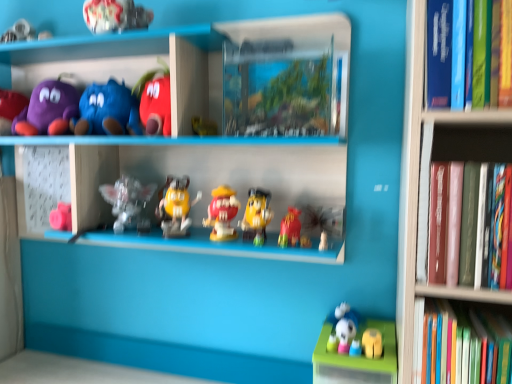
Question: Is purple plush toy at upper left, the second toy viewed from the left, beside smooth plastic m&m figure at center, positioned as the seventh toy in left-to-right order?

Choices:
 (A) no
 (B) yes

Answer: (A)

Question: Is purple plush toy at upper left, the second toy viewed from the left, oriented away from smooth plastic m&m figure at center, positioned as the seventh toy in left-to-right order?

Choices:
 (A) yes
 (B) no

Answer: (B)

Question: Is purple plush toy at upper left, the second toy viewed from the left, positioned in front of smooth plastic m&m figure at center, which is the fourth toy from right to left?

Choices:
 (A) yes
 (B) no

Answer: (B)

Question: Is smooth plastic m&m figure at center, which is the fourth toy from right to left, located within purple plush toy at upper left, the second toy viewed from the left?

Choices:
 (A) yes
 (B) no

Answer: (B)

Question: From the image's perspective, is purple plush toy at upper left, the second toy viewed from the left, over smooth plastic m&m figure at center, which is the fourth toy from right to left?

Choices:
 (A) no
 (B) yes

Answer: (B)

Question: From their relative heights in the image, would you say metallic silver toy at upper center, marked as the fifth toy in a left-to-right arrangement, is taller or shorter than matte plush toy at upper left, the eighth toy when ordered from right to left?

Choices:
 (A) short
 (B) tall

Answer: (A)

Question: Choose the correct answer: Is metallic silver toy at upper center, marked as the fifth toy in a left-to-right arrangement, inside matte plush toy at upper left, the eighth toy when ordered from right to left, or outside it?

Choices:
 (A) outside
 (B) inside

Answer: (A)

Question: Looking at their shapes, would you say metallic silver toy at upper center, marked as the fifth toy in a left-to-right arrangement, is wider or thinner than matte plush toy at upper left, the third toy from the left?

Choices:
 (A) wide
 (B) thin

Answer: (A)

Question: Relative to matte plush toy at upper left, the eighth toy when ordered from right to left, is metallic silver toy at upper center, which is counted as the sixth toy, starting from the right, in front or behind?

Choices:
 (A) behind
 (B) front

Answer: (B)

Question: From the image's perspective, is green plastic toy at lower right located above or below matte plush toy at upper left, the third toy from the left?

Choices:
 (A) above
 (B) below

Answer: (B)

Question: Is green plastic toy at lower right taller or shorter than matte plush toy at upper left, the third toy from the left?

Choices:
 (A) tall
 (B) short

Answer: (A)

Question: Looking at the image, does green plastic toy at lower right seem bigger or smaller compared to matte plush toy at upper left, the third toy from the left?

Choices:
 (A) small
 (B) big

Answer: (B)

Question: Is point (329, 375) closer or farther from the camera than point (123, 97)?

Choices:
 (A) closer
 (B) farther

Answer: (A)

Question: Considering the positions of translucent plastic figurine at center, the 4th toy from the left, and hardcover book at right, acting as the 1th book starting from the bottom, in the image, is translucent plastic figurine at center, the 4th toy from the left, wider or thinner than hardcover book at right, acting as the 1th book starting from the bottom,?

Choices:
 (A) wide
 (B) thin

Answer: (B)

Question: From the image's perspective, is translucent plastic figurine at center, marked as the 7th toy in a right-to-left arrangement, above or below hardcover book at right, acting as the 1th book starting from the bottom?

Choices:
 (A) above
 (B) below

Answer: (A)